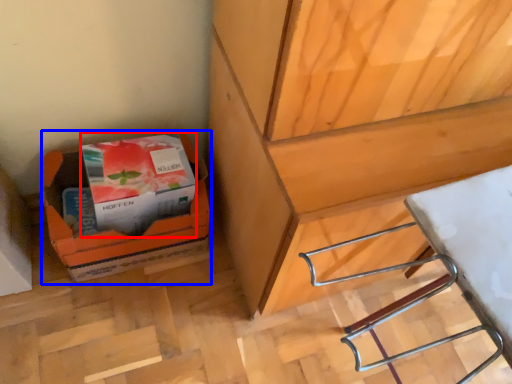
Question: Which object appears closest to the camera in this image, paperback book (highlighted by a red box) or cardboard box (highlighted by a blue box)?

Choices:
 (A) paperback book
 (B) cardboard box

Answer: (A)